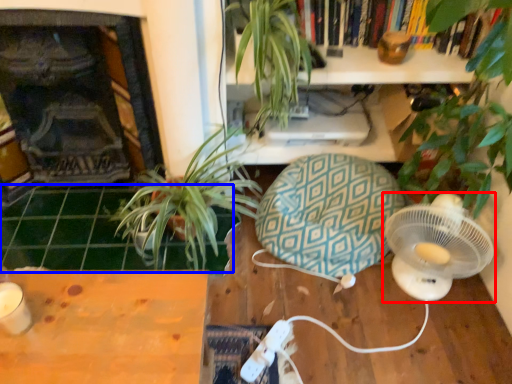
Question: Which point is closer to the camera, mechanical fan (highlighted by a red box) or tile (highlighted by a blue box)?

Choices:
 (A) mechanical fan
 (B) tile

Answer: (A)